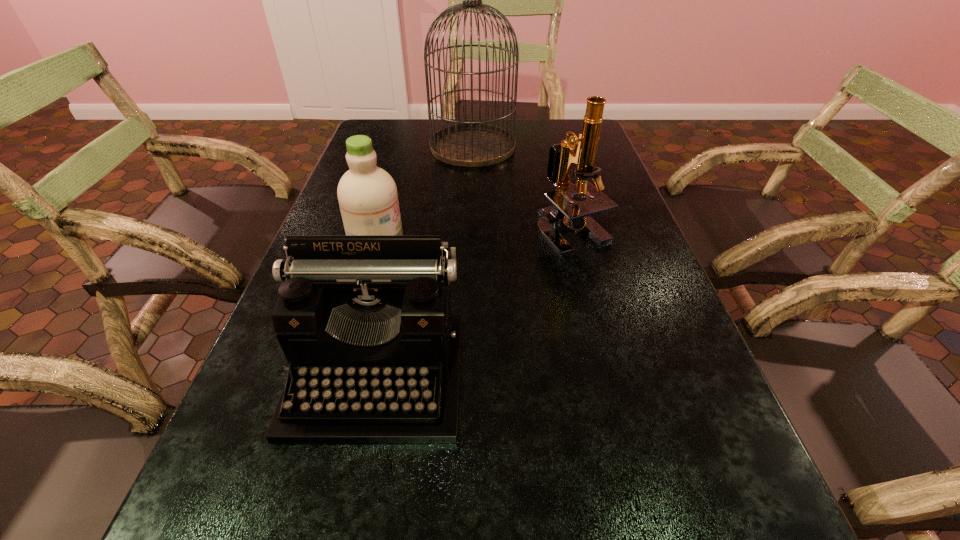
Identify the location of vacant space in between the rightmost object and the tallest object. This screenshot has width=960, height=540. (522, 190).

Identify the location of empty space between the microscope and the cleansing agent. The height and width of the screenshot is (540, 960). (474, 235).

Locate an element on the screen. Image resolution: width=960 pixels, height=540 pixels. unoccupied area between the rightmost object and the nearest object is located at coordinates (474, 303).

Image resolution: width=960 pixels, height=540 pixels. What are the coordinates of `free point between the birdcage and the rightmost object` in the screenshot? It's located at (522, 190).

Select which object appears as the closest to the birdcage. Please provide its 2D coordinates. Your answer should be formatted as a tuple, i.e. [(x, y)], where the tuple contains the x and y coordinates of a point satisfying the conditions above.

[(565, 211)]

Locate which object ranks second in proximity to the cleansing agent. Please provide its 2D coordinates. Your answer should be formatted as a tuple, i.e. [(x, y)], where the tuple contains the x and y coordinates of a point satisfying the conditions above.

[(471, 144)]

Locate an element on the screen. The height and width of the screenshot is (540, 960). free space that satisfies the following two spatial constraints: 1. at the eyepiece of the rightmost object; 2. on the front label of the cleansing agent is located at coordinates (573, 238).